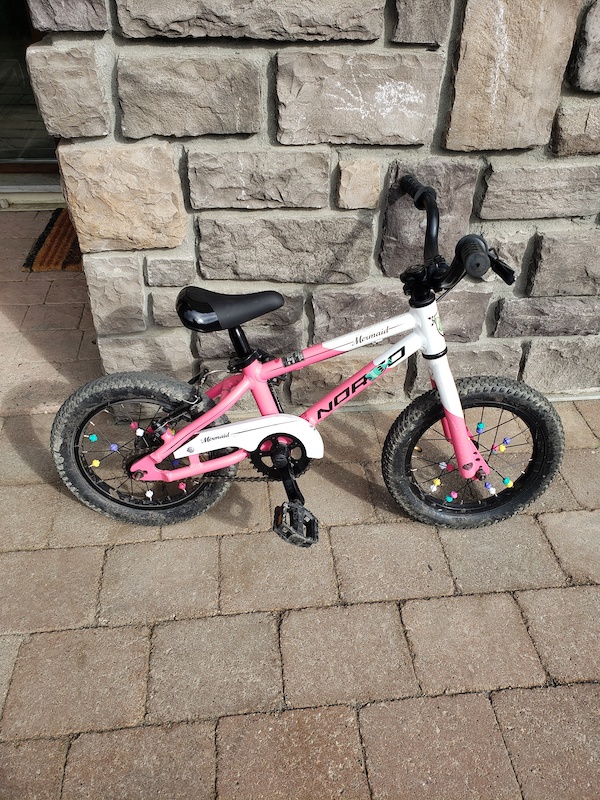
The image size is (600, 800). Identify the location of handle. (478, 274).